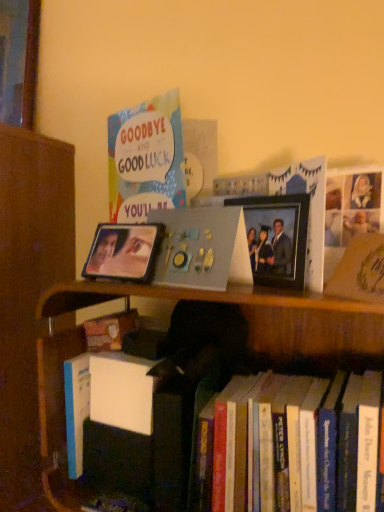
The width and height of the screenshot is (384, 512). What are the coordinates of `metallic reflective photo frame at center, the 2th picture frame viewed from the right` in the screenshot? It's located at pyautogui.click(x=124, y=251).

The image size is (384, 512). Identify the location of matte gray photo album at center. (201, 247).

Describe the element at coordinates (201, 247) in the screenshot. I see `matte gray photo album at center` at that location.

Image resolution: width=384 pixels, height=512 pixels. What are the coordinates of `matte paper card at upper left` in the screenshot? It's located at (145, 159).

The width and height of the screenshot is (384, 512). Identify the location of hardcover books at lower right. (249, 316).

Looking at this image, considering the sizes of objects metallic photo frame at center, the first picture frame positioned from the right, and matte paper card at upper left in the image provided, who is taller, metallic photo frame at center, the first picture frame positioned from the right, or matte paper card at upper left?

With more height is matte paper card at upper left.

From the image's perspective, which is below, metallic photo frame at center, which is the second picture frame in left-to-right order, or matte paper card at upper left?

metallic photo frame at center, which is the second picture frame in left-to-right order, from the image's perspective.

How far apart are metallic photo frame at center, the first picture frame positioned from the right, and matte paper card at upper left?

21.95 centimeters.

From a real-world perspective, who is located lower, metallic photo frame at center, the first picture frame positioned from the right, or matte paper card at upper left?

metallic photo frame at center, the first picture frame positioned from the right.

Are hardcover books at lower right and metallic photo frame at center, the first picture frame positioned from the right, far apart?

No, hardcover books at lower right is not far from metallic photo frame at center, the first picture frame positioned from the right.

From a real-world perspective, does hardcover books at lower right stand above metallic photo frame at center, the first picture frame positioned from the right?

No, from a real-world perspective, hardcover books at lower right is not on top of metallic photo frame at center, the first picture frame positioned from the right.

Is point (322, 353) closer to viewer compared to point (294, 221)?

No.

Could you measure the distance between hardcover books at lower right and metallic photo frame at center, the first picture frame positioned from the right?

The distance of hardcover books at lower right from metallic photo frame at center, the first picture frame positioned from the right, is 20.66 centimeters.

Does matte paper card at upper left appear on the right side of hardcover books at lower right?

In fact, matte paper card at upper left is to the left of hardcover books at lower right.

Is point (174, 139) less distant than point (304, 306)?

That is True.

Consider the image. From a real-world perspective, is matte paper card at upper left over hardcover books at lower right?

Yes.

Is matte paper card at upper left looking in the opposite direction of hardcover books at lower right?

matte paper card at upper left does not have its back to hardcover books at lower right.

From the image's perspective, is matte paper card at upper left under metallic photo frame at center, the first picture frame positioned from the right?

No.

Does matte paper card at upper left have a larger size compared to metallic photo frame at center, the first picture frame positioned from the right?

Indeed, matte paper card at upper left has a larger size compared to metallic photo frame at center, the first picture frame positioned from the right.

From a real-world perspective, relative to metallic photo frame at center, which is the second picture frame in left-to-right order, is matte paper card at upper left vertically above or below?

Clearly, from a real-world perspective, matte paper card at upper left is above metallic photo frame at center, which is the second picture frame in left-to-right order.

Which is behind, matte paper card at upper left or metallic photo frame at center, the first picture frame positioned from the right?

Positioned behind is matte paper card at upper left.

Are metallic photo frame at center, the first picture frame positioned from the right, and matte gray photo album at center far apart?

That's not correct — metallic photo frame at center, the first picture frame positioned from the right, is a little close to matte gray photo album at center.

Consider the image. Considering the relative positions of metallic photo frame at center, the first picture frame positioned from the right, and matte gray photo album at center in the image provided, is metallic photo frame at center, the first picture frame positioned from the right, behind matte gray photo album at center?

Yes, metallic photo frame at center, the first picture frame positioned from the right, is behind matte gray photo album at center.

Can you confirm if metallic photo frame at center, the first picture frame positioned from the right, is positioned to the left of matte gray photo album at center?

Incorrect, metallic photo frame at center, the first picture frame positioned from the right, is not on the left side of matte gray photo album at center.

From the picture: Is metallic photo frame at center, the first picture frame positioned from the right, facing towards matte gray photo album at center?

No, metallic photo frame at center, the first picture frame positioned from the right, is not aimed at matte gray photo album at center.

How far apart are metallic reflective photo frame at center, the 2th picture frame viewed from the right, and matte paper card at upper left?

A distance of 4.26 inches exists between metallic reflective photo frame at center, the 2th picture frame viewed from the right, and matte paper card at upper left.

Considering the positions of points (100, 240) and (154, 177), is point (100, 240) farther from camera compared to point (154, 177)?

No.

Could you tell me if metallic reflective photo frame at center, the 2th picture frame viewed from the right, is facing matte paper card at upper left?

No, metallic reflective photo frame at center, the 2th picture frame viewed from the right, does not turn towards matte paper card at upper left.

Is metallic reflective photo frame at center, the 2th picture frame viewed from the right, next to matte paper card at upper left and touching it?

No, metallic reflective photo frame at center, the 2th picture frame viewed from the right, is not with matte paper card at upper left.

Consider the image. Does matte gray photo album at center touch metallic reflective photo frame at center, the 2th picture frame viewed from the right?

Yes, matte gray photo album at center is in contact with metallic reflective photo frame at center, the 2th picture frame viewed from the right.

Which point is more forward, (178,279) or (117,271)?

Point (178,279)

In the scene shown: Does matte gray photo album at center have a larger size compared to metallic reflective photo frame at center, the 1th picture frame positioned from the left?

Yes, matte gray photo album at center is bigger than metallic reflective photo frame at center, the 1th picture frame positioned from the left.

Considering the positions of objects matte gray photo album at center and metallic reflective photo frame at center, the 1th picture frame positioned from the left, in the image provided, who is more to the left, matte gray photo album at center or metallic reflective photo frame at center, the 1th picture frame positioned from the left,?

Positioned to the left is metallic reflective photo frame at center, the 1th picture frame positioned from the left.

You are a GUI agent. You are given a task and a screenshot of the screen. Output one action in this format:
    pyautogui.click(x=<x>, y=<y>)
    Task: Click on the book above the metallic photo frame at center, the first picture frame positioned from the right (from the image's perspective)
    This screenshot has width=384, height=512.
    Given the screenshot: What is the action you would take?
    pyautogui.click(x=145, y=159)

Image resolution: width=384 pixels, height=512 pixels. I want to click on bookcase below the metallic photo frame at center, the first picture frame positioned from the right (from the image's perspective), so click(x=249, y=316).

When comparing their distances from matte gray photo album at center, does hardcover books at lower right or matte paper card at upper left seem further?

The object further to matte gray photo album at center is hardcover books at lower right.

From the image, which object appears to be nearer to metallic reflective photo frame at center, the 2th picture frame viewed from the right, matte gray photo album at center or metallic photo frame at center, the first picture frame positioned from the right?

matte gray photo album at center is closer to metallic reflective photo frame at center, the 2th picture frame viewed from the right.

When comparing their distances from metallic reflective photo frame at center, the 1th picture frame positioned from the left, does matte paper card at upper left or matte gray photo album at center seem further?

matte paper card at upper left.

Considering their positions, is matte paper card at upper left positioned further to metallic reflective photo frame at center, the 2th picture frame viewed from the right, than metallic photo frame at center, the first picture frame positioned from the right?

metallic photo frame at center, the first picture frame positioned from the right, is positioned further to the anchor metallic reflective photo frame at center, the 2th picture frame viewed from the right.

Estimate the real-world distances between objects in this image. Which object is closer to metallic reflective photo frame at center, the 2th picture frame viewed from the right, hardcover books at lower right or metallic photo frame at center, the first picture frame positioned from the right?

hardcover books at lower right is positioned closer to the anchor metallic reflective photo frame at center, the 2th picture frame viewed from the right.

Which object lies nearer to the anchor point hardcover books at lower right, metallic photo frame at center, which is the second picture frame in left-to-right order, or metallic reflective photo frame at center, the 1th picture frame positioned from the left?

metallic reflective photo frame at center, the 1th picture frame positioned from the left, lies closer to hardcover books at lower right than the other object.

Looking at the image, which one is located closer to hardcover books at lower right, matte paper card at upper left or matte gray photo album at center?

matte gray photo album at center is closer to hardcover books at lower right.

From the image, which object appears to be farther from metallic reflective photo frame at center, the 1th picture frame positioned from the left, hardcover books at lower right or matte paper card at upper left?

Based on the image, hardcover books at lower right appears to be further to metallic reflective photo frame at center, the 1th picture frame positioned from the left.

Locate an element on the screen. paperback book between matte paper card at upper left and metallic photo frame at center, which is the second picture frame in left-to-right order, in the horizontal direction is located at coordinates (201, 247).

Locate an element on the screen. picture frame between matte gray photo album at center and hardcover books at lower right from top to bottom is located at coordinates (124, 251).

The height and width of the screenshot is (512, 384). I want to click on book situated between metallic reflective photo frame at center, the 1th picture frame positioned from the left, and metallic photo frame at center, the first picture frame positioned from the right, from left to right, so click(x=145, y=159).

Locate an element on the screen. paperback book between matte paper card at upper left and metallic reflective photo frame at center, the 1th picture frame positioned from the left, in the vertical direction is located at coordinates (201, 247).